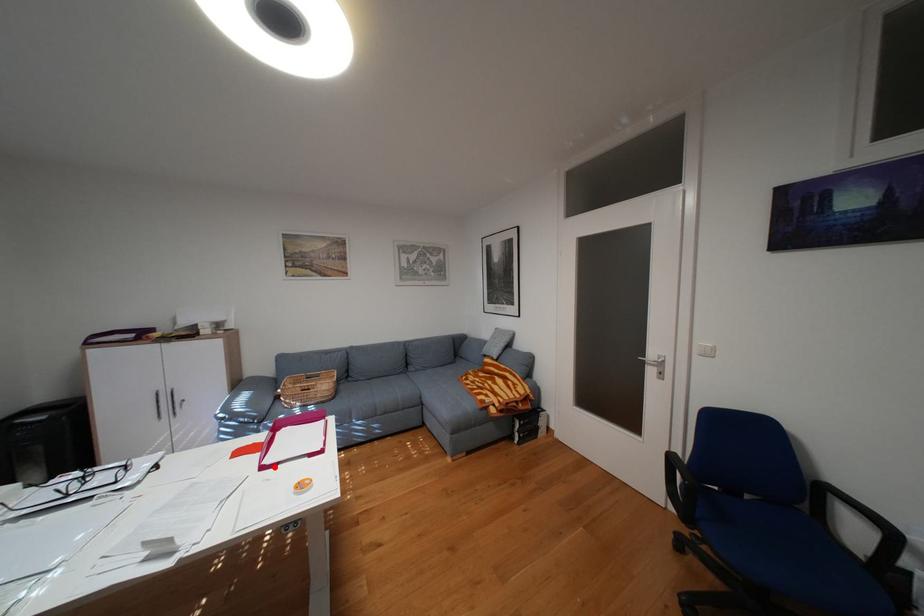
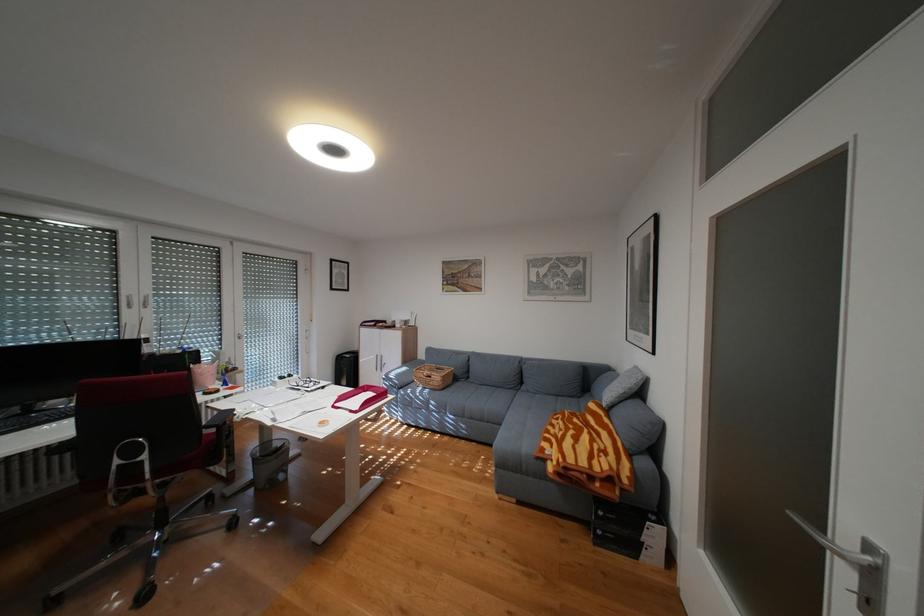
In the second image, find the point that corresponds to the highlighted location in the first image.

(346, 406)